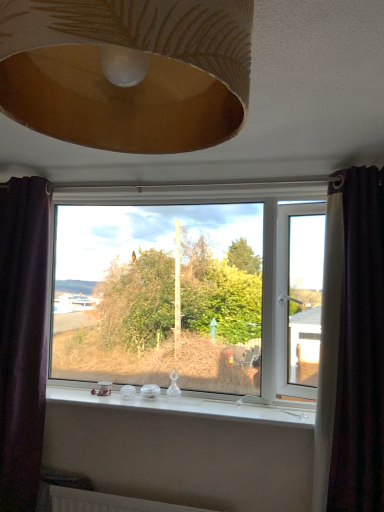
Question: Is white glossy window sill at center positioned with its back to purple fabric curtain at left, positioned as the 1th curtain in left-to-right order?

Choices:
 (A) no
 (B) yes

Answer: (A)

Question: Could you tell me if white glossy window sill at center is turned towards purple fabric curtain at left, marked as the 2th curtain in a right-to-left arrangement?

Choices:
 (A) no
 (B) yes

Answer: (A)

Question: Would you say white glossy window sill at center is a long distance from purple fabric curtain at left, positioned as the 1th curtain in left-to-right order?

Choices:
 (A) yes
 (B) no

Answer: (B)

Question: Is white glossy window sill at center smaller than purple fabric curtain at left, marked as the 2th curtain in a right-to-left arrangement?

Choices:
 (A) no
 (B) yes

Answer: (B)

Question: Does white glossy window sill at center come behind purple fabric curtain at left, positioned as the 1th curtain in left-to-right order?

Choices:
 (A) yes
 (B) no

Answer: (B)

Question: Considering the positions of point pos(382,415) and point pos(86,271), is point pos(382,415) closer or farther from the camera than point pos(86,271)?

Choices:
 (A) farther
 (B) closer

Answer: (B)

Question: In the image, is dark purple velvet curtain at right, arranged as the second curtain when viewed from the left, positioned in front of or behind transparent glass window at center?

Choices:
 (A) front
 (B) behind

Answer: (A)

Question: Looking at the image, does dark purple velvet curtain at right, arranged as the second curtain when viewed from the left, seem bigger or smaller compared to transparent glass window at center?

Choices:
 (A) big
 (B) small

Answer: (B)

Question: From a real-world perspective, is dark purple velvet curtain at right, arranged as the second curtain when viewed from the left, positioned above or below transparent glass window at center?

Choices:
 (A) above
 (B) below

Answer: (B)

Question: Does point (349, 241) appear closer or farther from the camera than point (89, 31)?

Choices:
 (A) farther
 (B) closer

Answer: (A)

Question: From the image's perspective, is dark purple velvet curtain at right, which is counted as the first curtain, starting from the right, located above or below gold textured lampshade at upper center?

Choices:
 (A) below
 (B) above

Answer: (A)

Question: In terms of height, does dark purple velvet curtain at right, arranged as the second curtain when viewed from the left, look taller or shorter compared to gold textured lampshade at upper center?

Choices:
 (A) tall
 (B) short

Answer: (A)

Question: Considering their positions, is dark purple velvet curtain at right, which is counted as the first curtain, starting from the right, located in front of or behind gold textured lampshade at upper center?

Choices:
 (A) behind
 (B) front

Answer: (A)

Question: In the image, is purple fabric curtain at left, positioned as the 1th curtain in left-to-right order, on the left side or the right side of white glossy window sill at center?

Choices:
 (A) left
 (B) right

Answer: (A)

Question: From the image's perspective, relative to white glossy window sill at center, is purple fabric curtain at left, positioned as the 1th curtain in left-to-right order, above or below?

Choices:
 (A) below
 (B) above

Answer: (B)